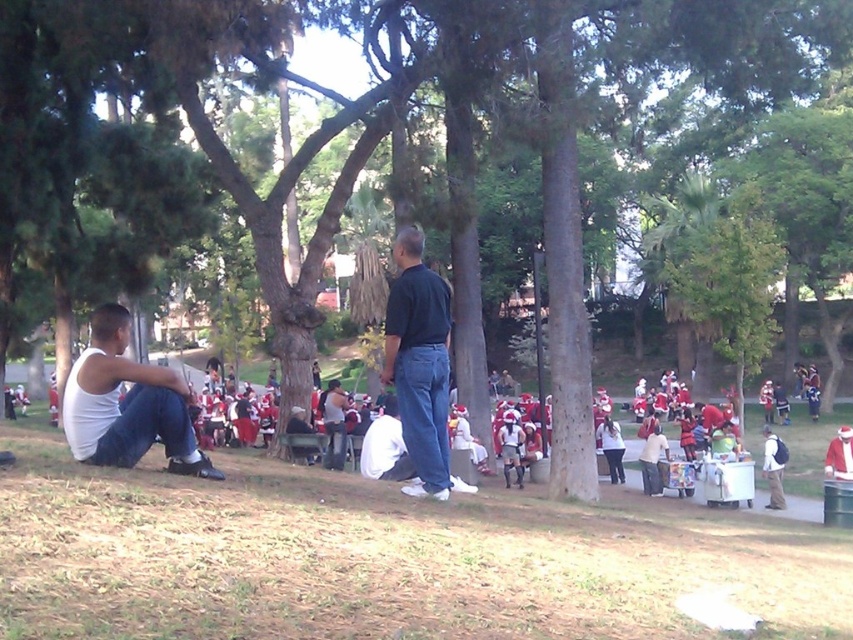
Is black matte shirt at center to the left of white matte jacket at lower right from the viewer's perspective?

Yes, black matte shirt at center is to the left of white matte jacket at lower right.

Is point (419, 337) positioned behind point (624, 474)?

No.

The image size is (853, 640). I want to click on black matte shirt at center, so click(x=419, y=362).

Is white matte shirt at lower right wider than white matte jacket at lower right?

In fact, white matte shirt at lower right might be narrower than white matte jacket at lower right.

Where is `white matte shirt at lower right`? This screenshot has height=640, width=853. white matte shirt at lower right is located at coordinates (653, 460).

Who is more distant from viewer, (457, 627) or (602, 432)?

Point (602, 432)

Looking at this image, can you confirm if green grass at lower left is taller than white matte jacket at lower right?

Yes, green grass at lower left is taller than white matte jacket at lower right.

Measure the distance between point (271,614) and camera.

They are 4.29 meters apart.

The image size is (853, 640). Identify the location of green grass at lower left. [386, 556].